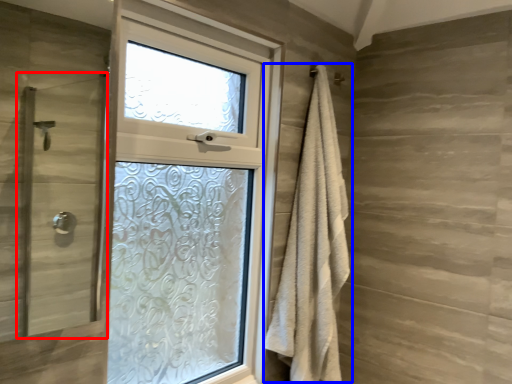
Question: Which object is closer to the camera taking this photo, screen door (highlighted by a red box) or bath towel (highlighted by a blue box)?

Choices:
 (A) screen door
 (B) bath towel

Answer: (A)